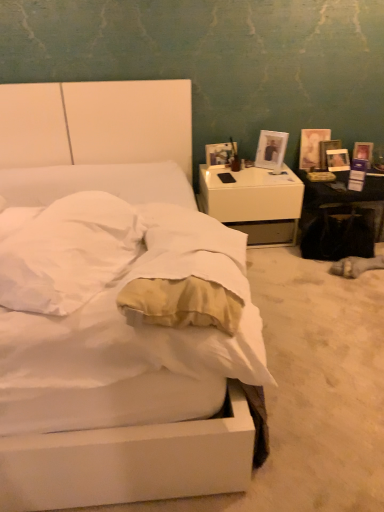
Question: Should I look upward or downward to see white glossy table at right?

Choices:
 (A) down
 (B) up

Answer: (B)

Question: Considering the relative sizes of white matte bed at center and matte white picture frame at right, the 2th picture frame in the left-to-right sequence, in the image provided, is white matte bed at center thinner than matte white picture frame at right, the 2th picture frame in the left-to-right sequence,?

Choices:
 (A) yes
 (B) no

Answer: (B)

Question: Is white matte bed at center completely or partially outside of matte white picture frame at right, acting as the second picture frame starting from the front?

Choices:
 (A) yes
 (B) no

Answer: (A)

Question: From a real-world perspective, is white matte bed at center on top of matte white picture frame at right, which is the first picture frame in back-to-front order?

Choices:
 (A) no
 (B) yes

Answer: (B)

Question: Is white matte bed at center not near matte white picture frame at right, the 2th picture frame in the left-to-right sequence?

Choices:
 (A) no
 (B) yes

Answer: (B)

Question: Does white matte bed at center appear on the left side of matte white picture frame at right, acting as the second picture frame starting from the front?

Choices:
 (A) yes
 (B) no

Answer: (A)

Question: Can you confirm if white matte bed at center is smaller than matte white picture frame at right, which is the first picture frame in back-to-front order?

Choices:
 (A) no
 (B) yes

Answer: (A)

Question: Can you confirm if white glossy picture frame at upper right, positioned as the second picture frame in right-to-left order, is positioned to the right of white glossy table at right?

Choices:
 (A) no
 (B) yes

Answer: (A)

Question: Is white glossy picture frame at upper right, which is counted as the first picture frame, starting from the front, bigger than white glossy table at right?

Choices:
 (A) yes
 (B) no

Answer: (B)

Question: Is white glossy picture frame at upper right, which appears as the first picture frame when viewed from the left, further to the viewer compared to white glossy table at right?

Choices:
 (A) yes
 (B) no

Answer: (A)

Question: From a real-world perspective, is white glossy picture frame at upper right, which is counted as the first picture frame, starting from the front, on white glossy table at right?

Choices:
 (A) yes
 (B) no

Answer: (A)

Question: From the image's perspective, is white glossy picture frame at upper right, which appears as the first picture frame when viewed from the left, beneath white glossy table at right?

Choices:
 (A) no
 (B) yes

Answer: (A)

Question: Is white glossy picture frame at upper right, marked as the second picture frame in a back-to-front arrangement, oriented away from white glossy table at right?

Choices:
 (A) yes
 (B) no

Answer: (B)

Question: Can we say white glossy picture frame at upper right, marked as the second picture frame in a back-to-front arrangement, lies outside white matte bed at center?

Choices:
 (A) yes
 (B) no

Answer: (A)